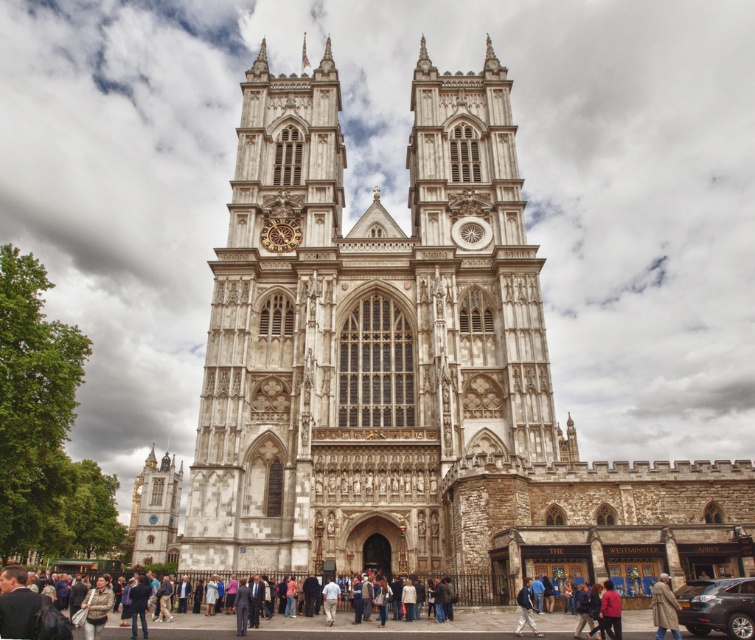
You are standing in front of Westminster Abbey and notice two points marked on its facade. The first point is at coordinates point (673, 625) and the second at point (525, 593). Which of these two points is closer to you?

Point (673, 625) is closer to the viewer than point (525, 593).

You are a visitor at Westminster Abbey and you see a light brown leather coat at lower right and a blue denim jacket at lower center. Which item is placed on top of the other?

The light brown leather coat at lower right is positioned over blue denim jacket at lower center.

You are standing in front of Westminster Abbey and notice the stone clock tower at lower left and the light brown leather coat at lower right. Which object is positioned lower in the image?

The stone clock tower at lower left is located below the light brown leather coat at lower right, so the stone clock tower at lower left is positioned lower in the image.